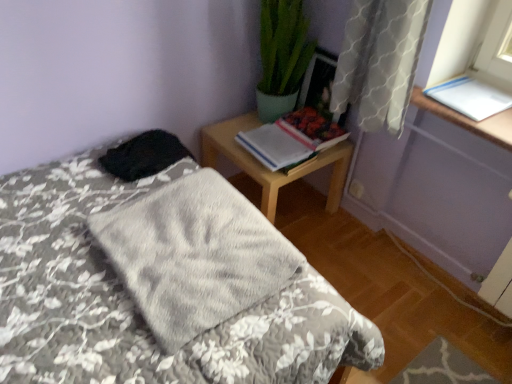
Question: Would you say fluffy gray blanket at center is to the left or to the right of hardcover book at upper right, arranged as the second book when viewed from the left, in the picture?

Choices:
 (A) left
 (B) right

Answer: (A)

Question: Considering the positions of fluffy gray blanket at center and hardcover book at upper right, arranged as the second book when viewed from the left, in the image, is fluffy gray blanket at center taller or shorter than hardcover book at upper right, arranged as the second book when viewed from the left,?

Choices:
 (A) tall
 (B) short

Answer: (A)

Question: Considering the real-world distances, which object is farthest from the fluffy gray blanket at center?

Choices:
 (A) white paper at upper right, marked as the 3th book in a left-to-right arrangement
 (B) gray soft blanket at center
 (C) wooden nightstand at upper right
 (D) wooden picture frame at upper right
 (E) hardcover book at upper right, arranged as the second book when viewed from the left

Answer: (A)

Question: Which of these objects is positioned closest to the wooden picture frame at upper right?

Choices:
 (A) hardcover book at upper right, arranged as the second book when viewed from the left
 (B) white paper at upper right, placed as the first book when sorted from right to left
 (C) hardcover book at upper right, the first book in the left-to-right sequence
 (D) fluffy gray blanket at center
 (E) wooden nightstand at upper right

Answer: (A)